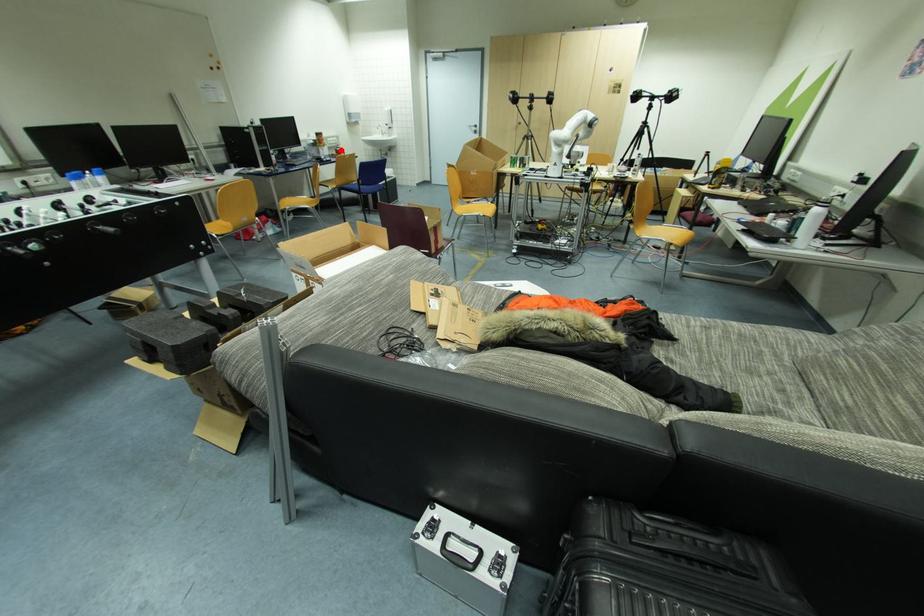
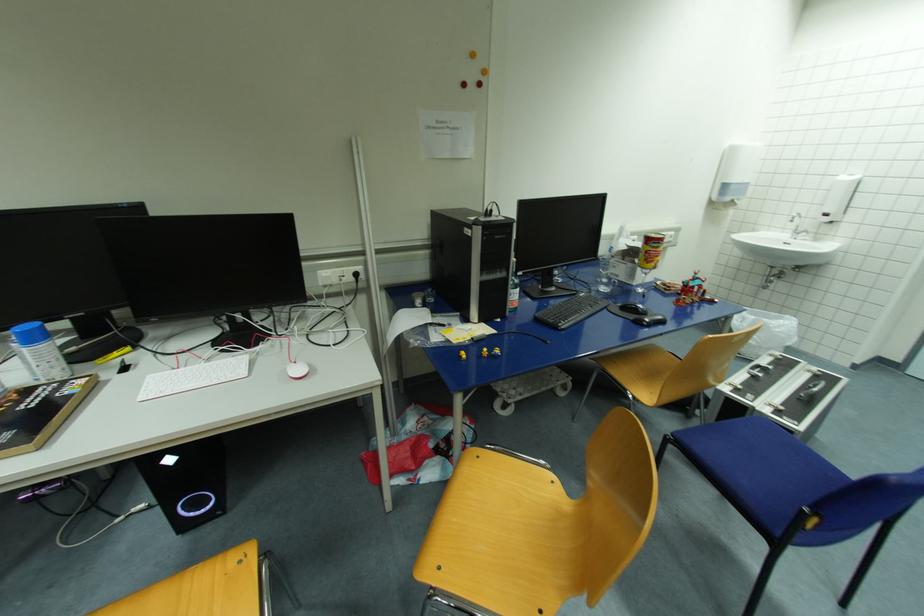
Question: I am providing you with two images of the same scene from different viewpoints. A red point is marked on the first image. At the location where the point appears in image 1, is it still visible in image 2?

Choices:
 (A) Yes
 (B) No

Answer: (A)